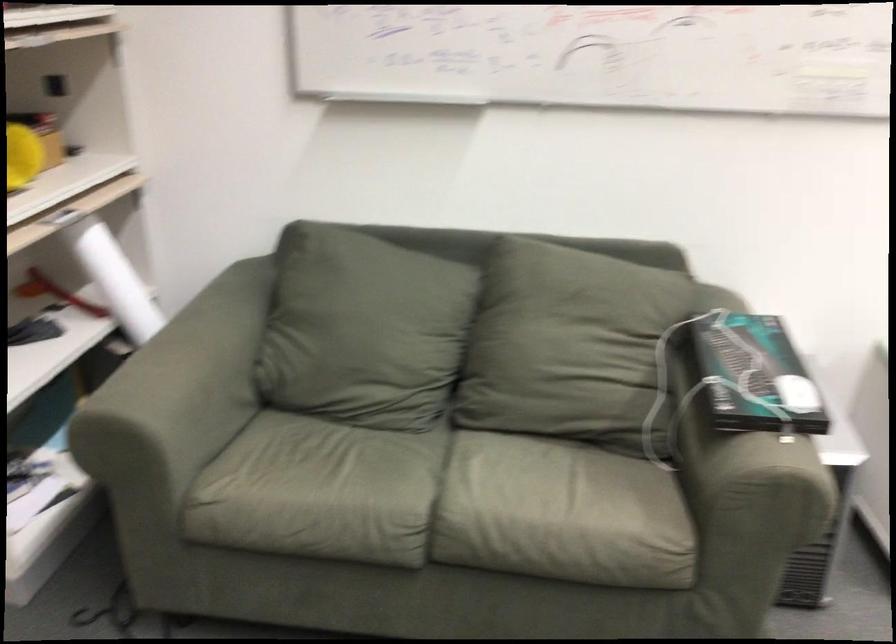
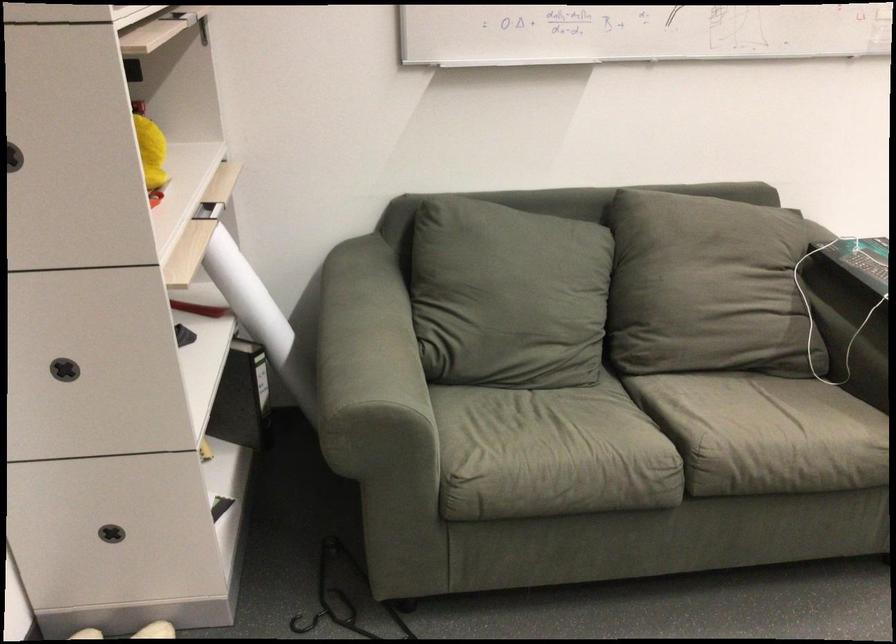
In the second image, find the point that corresponds to point (164, 357) in the first image.

(358, 342)